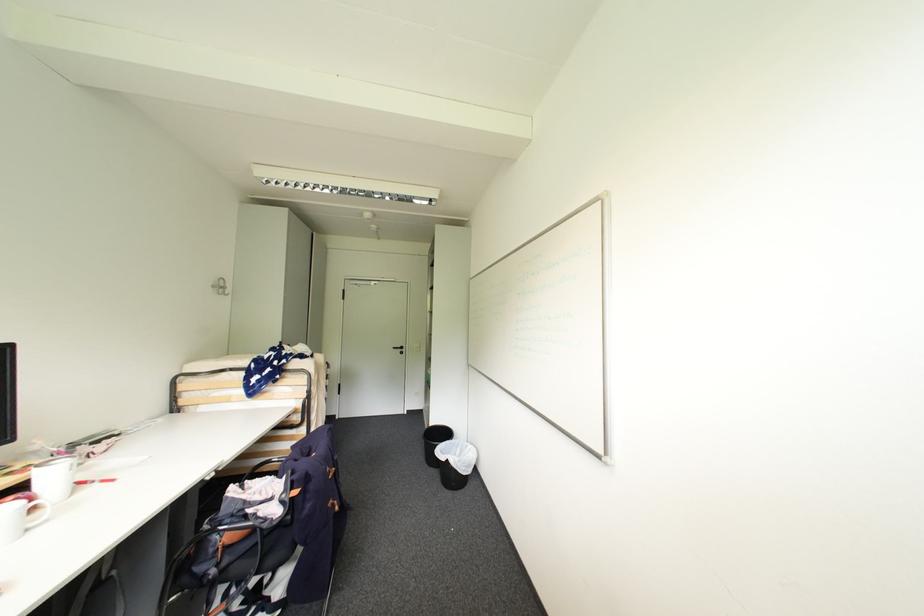
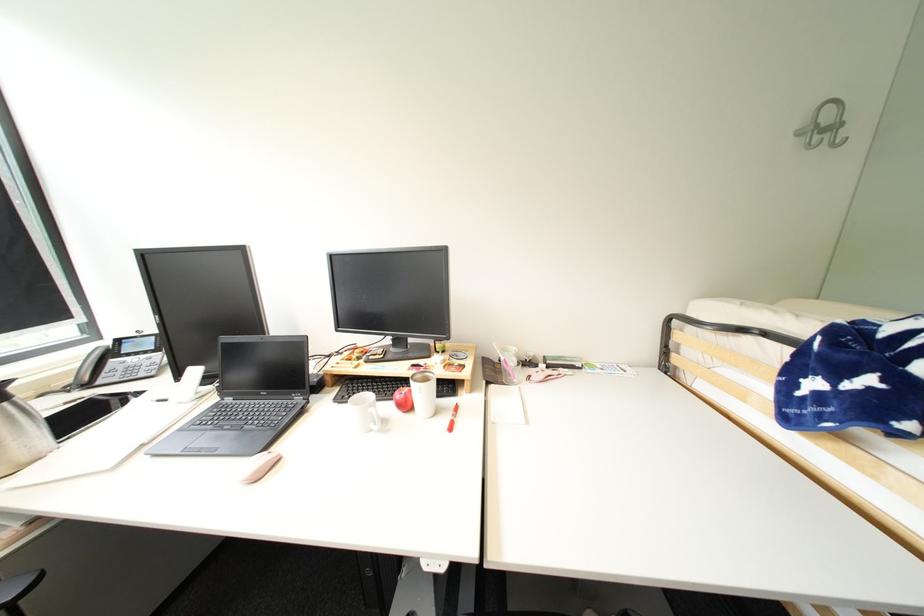
Question: I am providing you with two images of the same scene from different viewpoints. After the viewpoint changes to image2, which objects are now occluded?

Choices:
 (A) clear glass cup
 (B) white travel mug
 (C) metal wall hook
 (D) none of these

Answer: (D)